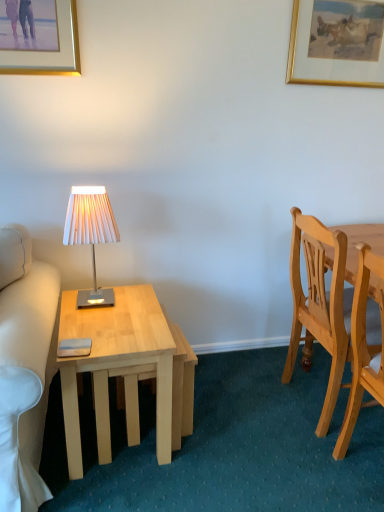
Question: From the image's perspective, is white pleated fabric lampshade at left located above or below gold/golden frame at upper right, acting as the 1th picture frame starting from the back?

Choices:
 (A) below
 (B) above

Answer: (A)

Question: In terms of width, does white pleated fabric lampshade at left look wider or thinner when compared to gold/golden frame at upper right, marked as the 1th picture frame in a right-to-left arrangement?

Choices:
 (A) thin
 (B) wide

Answer: (B)

Question: Estimate the real-world distances between objects in this image. Which object is farther from the light wood desk at left?

Choices:
 (A) light wood chair at right, which ranks as the first chair in front-to-back order
 (B) gold-framed picture at upper left, which ranks as the 2th picture frame in right-to-left order
 (C) white pleated fabric lampshade at left
 (D) gold/golden frame at upper right, marked as the 1th picture frame in a right-to-left arrangement
 (E) light wood chair at right, arranged as the first chair when viewed from the back

Answer: (D)

Question: Estimate the real-world distances between objects in this image. Which object is farther from the white pleated fabric lampshade at left?

Choices:
 (A) gold-framed picture at upper left, which ranks as the 1th picture frame in front-to-back order
 (B) light wood chair at right, which ranks as the first chair in front-to-back order
 (C) light wood chair at right, arranged as the first chair when viewed from the back
 (D) light wood desk at left
 (E) gold/golden frame at upper right, acting as the 1th picture frame starting from the back

Answer: (E)